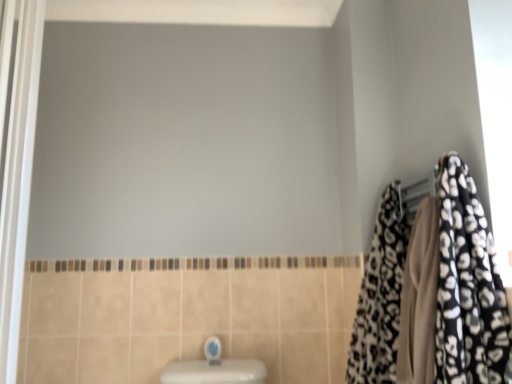
Question: Is leopard print towel at right behind white glossy screen door at left?

Choices:
 (A) no
 (B) yes

Answer: (B)

Question: Considering the relative sizes of leopard print towel at right and white glossy screen door at left in the image provided, is leopard print towel at right smaller than white glossy screen door at left?

Choices:
 (A) no
 (B) yes

Answer: (A)

Question: Considering the relative sizes of leopard print towel at right and white glossy screen door at left in the image provided, is leopard print towel at right thinner than white glossy screen door at left?

Choices:
 (A) yes
 (B) no

Answer: (B)

Question: Can you see leopard print towel at right touching white glossy screen door at left?

Choices:
 (A) no
 (B) yes

Answer: (A)

Question: From a real-world perspective, is leopard print towel at right located higher than white glossy screen door at left?

Choices:
 (A) yes
 (B) no

Answer: (B)

Question: Based on their positions, is leopard print fabric at right located to the left or right of leopard print towel at right?

Choices:
 (A) left
 (B) right

Answer: (B)

Question: Considering the positions of leopard print fabric at right and leopard print towel at right in the image, is leopard print fabric at right wider or thinner than leopard print towel at right?

Choices:
 (A) wide
 (B) thin

Answer: (B)

Question: In the image, is leopard print fabric at right positioned in front of or behind leopard print towel at right?

Choices:
 (A) behind
 (B) front

Answer: (B)

Question: Considering the positions of leopard print fabric at right and leopard print towel at right in the image, is leopard print fabric at right taller or shorter than leopard print towel at right?

Choices:
 (A) tall
 (B) short

Answer: (B)

Question: Considering their positions, is leopard print towel at right located in front of or behind leopard print fabric at right?

Choices:
 (A) front
 (B) behind

Answer: (B)

Question: Considering the positions of leopard print towel at right and leopard print fabric at right in the image, is leopard print towel at right wider or thinner than leopard print fabric at right?

Choices:
 (A) thin
 (B) wide

Answer: (B)

Question: Choose the correct answer: Is leopard print towel at right inside leopard print fabric at right or outside it?

Choices:
 (A) outside
 (B) inside

Answer: (A)

Question: From the image's perspective, relative to leopard print fabric at right, is leopard print towel at right above or below?

Choices:
 (A) above
 (B) below

Answer: (B)

Question: From the image's perspective, is leopard print towel at right positioned above or below blue glossy faucet at lower center?

Choices:
 (A) below
 (B) above

Answer: (B)

Question: Considering the positions of leopard print towel at right and blue glossy faucet at lower center in the image, is leopard print towel at right bigger or smaller than blue glossy faucet at lower center?

Choices:
 (A) small
 (B) big

Answer: (B)